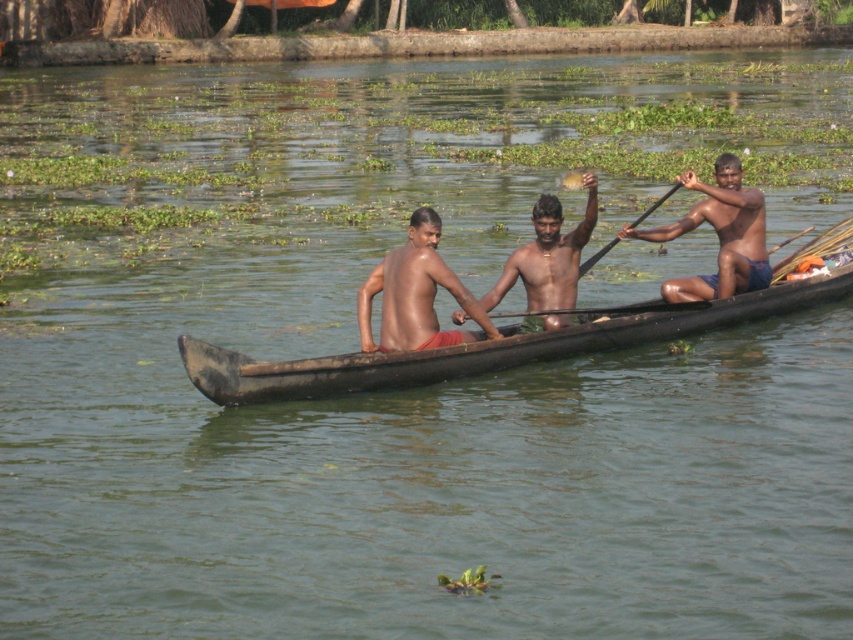
Question: In this image, where is matte skin man at center located relative to brown skin man at center?

Choices:
 (A) above
 (B) below

Answer: (B)

Question: Which point appears closest to the camera in this image?

Choices:
 (A) (541, 204)
 (B) (610, 244)

Answer: (A)

Question: Which point is closer to the camera?

Choices:
 (A) (563, 282)
 (B) (250, 362)
 (C) (432, 314)
 (D) (674, 188)

Answer: (B)

Question: Which object is positioned farthest from the shiny blue shorts at right?

Choices:
 (A) dark brown wooden boat at center
 (B) wooden paddle at center
 (C) matte skin man at center

Answer: (A)

Question: Is matte skin man at center to the right of shiny blue shorts at right from the viewer's perspective?

Choices:
 (A) no
 (B) yes

Answer: (A)

Question: Does dark brown wooden boat at center appear over matte skin man at center?

Choices:
 (A) yes
 (B) no

Answer: (B)